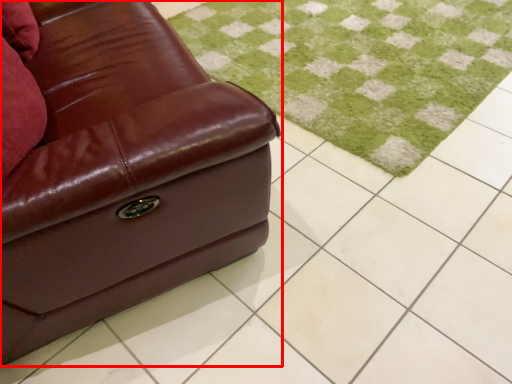
Question: From the image's perspective, where is studio couch (annotated by the red box) located in relation to grass in the image?

Choices:
 (A) above
 (B) below

Answer: (B)